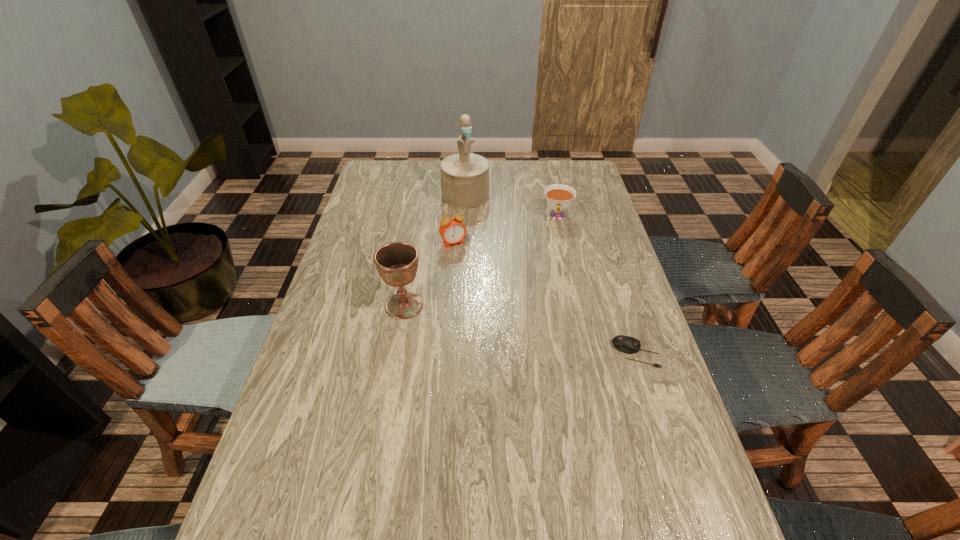
Locate an element on the screen. The width and height of the screenshot is (960, 540). free space located on the front of the shortest object is located at coordinates (659, 424).

This screenshot has height=540, width=960. I want to click on vacant space positioned on the side of the second shortest object with the handle, so [555, 244].

Find the location of `free spot located on the side of the second shortest object with the handle`. free spot located on the side of the second shortest object with the handle is located at coordinates (552, 269).

Where is `vacant space positioned on the side of the second shortest object with the handle`? This screenshot has width=960, height=540. vacant space positioned on the side of the second shortest object with the handle is located at coordinates (549, 301).

Find the location of a particular element. This screenshot has height=540, width=960. free region located 0.220m at the beak of the figurine is located at coordinates (486, 245).

This screenshot has height=540, width=960. I want to click on vacant position located at the beak of the figurine, so click(x=498, y=276).

This screenshot has width=960, height=540. In order to click on free location located at the beak of the figurine in this screenshot , I will do `click(494, 266)`.

Locate an element on the screen. Image resolution: width=960 pixels, height=540 pixels. free point located on the face of the third nearest object is located at coordinates click(x=472, y=269).

Identify the location of free region located on the face of the third nearest object. (474, 273).

Locate an element on the screen. This screenshot has height=540, width=960. free space located on the face of the third nearest object is located at coordinates (476, 275).